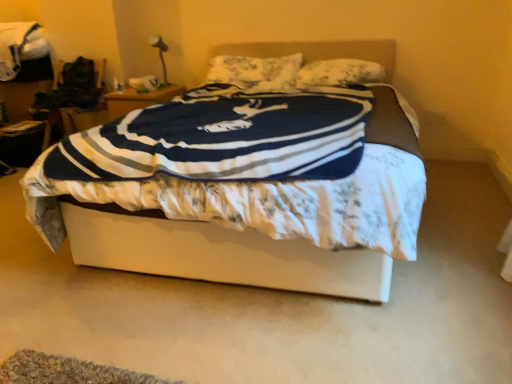
Question: Does white fabric bed at center have a lesser height compared to floral fabric pillow at center, marked as the 1th pillow in a left-to-right arrangement?

Choices:
 (A) no
 (B) yes

Answer: (A)

Question: Is the depth of white fabric bed at center greater than that of floral fabric pillow at center, the 2th pillow in the right-to-left sequence?

Choices:
 (A) no
 (B) yes

Answer: (A)

Question: Is floral fabric pillow at center, the 2th pillow in the right-to-left sequence, completely or partially inside white fabric bed at center?

Choices:
 (A) yes
 (B) no

Answer: (A)

Question: From a real-world perspective, is white fabric bed at center on floral fabric pillow at center, marked as the 1th pillow in a left-to-right arrangement?

Choices:
 (A) yes
 (B) no

Answer: (B)

Question: Does white fabric bed at center touch floral fabric pillow at center, marked as the 1th pillow in a left-to-right arrangement?

Choices:
 (A) yes
 (B) no

Answer: (B)

Question: Is white fabric bed at center to the right of floral fabric pillow at center, the 2th pillow in the right-to-left sequence, from the viewer's perspective?

Choices:
 (A) no
 (B) yes

Answer: (B)

Question: Is metallic silver table lamp at upper left positioned beyond the bounds of fluffy white pillow at upper center, marked as the first pillow in a right-to-left arrangement?

Choices:
 (A) yes
 (B) no

Answer: (A)

Question: Considering the relative sizes of metallic silver table lamp at upper left and fluffy white pillow at upper center, marked as the first pillow in a right-to-left arrangement, in the image provided, is metallic silver table lamp at upper left bigger than fluffy white pillow at upper center, marked as the first pillow in a right-to-left arrangement,?

Choices:
 (A) no
 (B) yes

Answer: (A)

Question: From the image's perspective, does metallic silver table lamp at upper left appear lower than fluffy white pillow at upper center, placed as the 2th pillow when sorted from left to right?

Choices:
 (A) no
 (B) yes

Answer: (A)

Question: Is metallic silver table lamp at upper left positioned before fluffy white pillow at upper center, placed as the 2th pillow when sorted from left to right?

Choices:
 (A) no
 (B) yes

Answer: (A)

Question: Is metallic silver table lamp at upper left oriented away from fluffy white pillow at upper center, placed as the 2th pillow when sorted from left to right?

Choices:
 (A) yes
 (B) no

Answer: (B)

Question: Is metallic silver table lamp at upper left at the left side of fluffy white pillow at upper center, placed as the 2th pillow when sorted from left to right?

Choices:
 (A) yes
 (B) no

Answer: (A)

Question: Does white fabric bed at center have a lesser height compared to fluffy white pillow at upper center, placed as the 2th pillow when sorted from left to right?

Choices:
 (A) no
 (B) yes

Answer: (A)